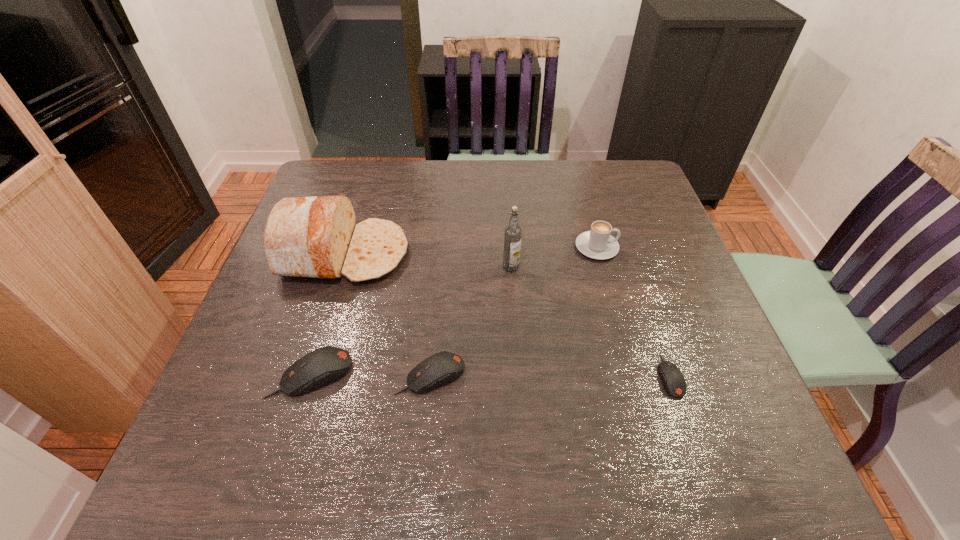
The height and width of the screenshot is (540, 960). I want to click on free spot located 0.260m on the left of the second computer mouse from left to right, so click(x=267, y=375).

Identify the location of vacant space located 0.110m on the right of the shortest computer mouse. The height and width of the screenshot is (540, 960). (735, 376).

Locate an element on the screen. This screenshot has height=540, width=960. free space located 0.100m to the right of the cappuccino is located at coordinates (657, 247).

Locate an element on the screen. The image size is (960, 540). vacant space situated 0.080m on the label of the tallest object is located at coordinates (513, 298).

The width and height of the screenshot is (960, 540). Find the location of `free space located at the sliced end of the second tallest object`. free space located at the sliced end of the second tallest object is located at coordinates (451, 254).

Find the location of a particular element. The width and height of the screenshot is (960, 540). computer mouse at the left edge is located at coordinates (325, 365).

This screenshot has height=540, width=960. Find the location of `bread situated at the left edge`. bread situated at the left edge is located at coordinates (316, 237).

Where is `computer mouse present at the right edge`? The height and width of the screenshot is (540, 960). computer mouse present at the right edge is located at coordinates (673, 382).

Locate an element on the screen. cappuccino at the right edge is located at coordinates (598, 243).

The width and height of the screenshot is (960, 540). I want to click on object present at the near left corner, so click(x=325, y=365).